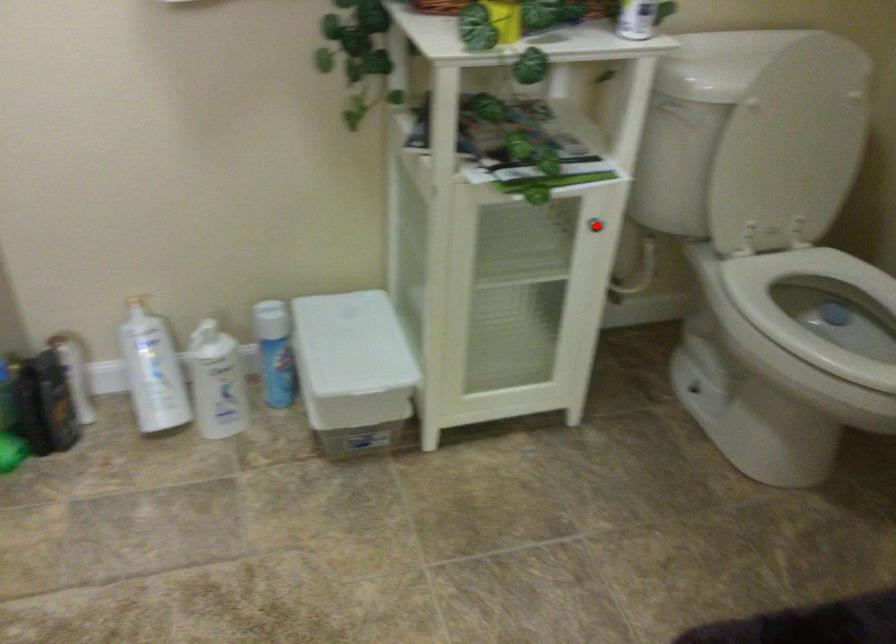
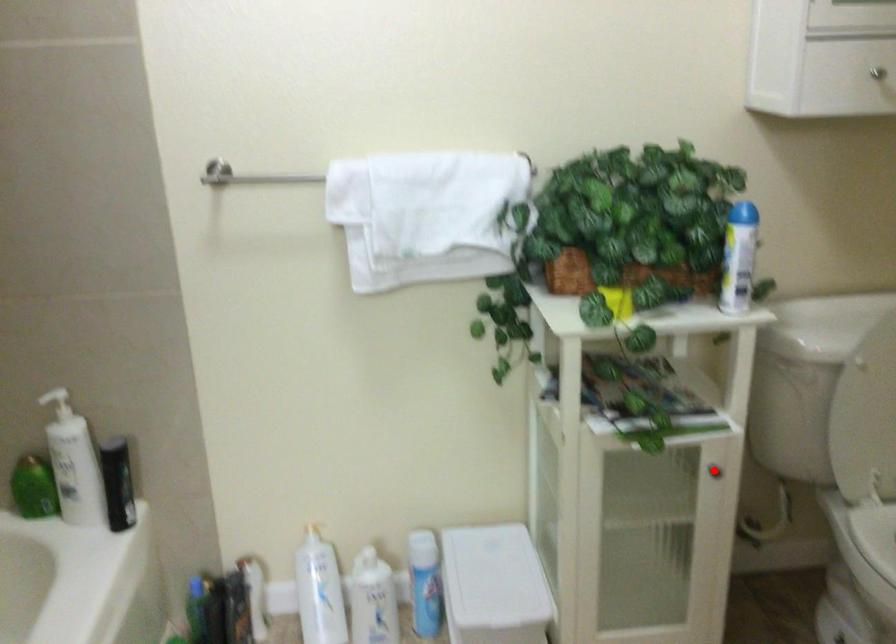
I am providing you with two images of the same scene from different viewpoints. A red point is marked on the first image and another point is marked on the second image. Is the marked point in image1 the same physical position as the marked point in image2?

Yes